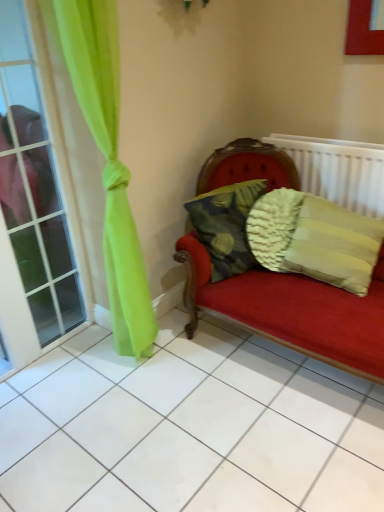
What is the approximate width of camouflage fabric pillow at center, the 1th pillow positioned from the left?

It is 8.81 inches.

The height and width of the screenshot is (512, 384). What do you see at coordinates (32, 211) in the screenshot? I see `clear glass window at left` at bounding box center [32, 211].

This screenshot has width=384, height=512. I want to click on clear glass window at left, so click(x=32, y=211).

The width and height of the screenshot is (384, 512). Identify the location of textured beige pillow at right, arranged as the first pillow when viewed from the right. (314, 239).

The height and width of the screenshot is (512, 384). What are the coordinates of `white textured radiator at upper right` in the screenshot? It's located at (338, 170).

Is textured beige pillow at right, arranged as the second pillow when viewed from the left, oriented away from white textured radiator at upper right?

Yes, white textured radiator at upper right is at the back of textured beige pillow at right, arranged as the second pillow when viewed from the left.

Between textured beige pillow at right, arranged as the first pillow when viewed from the right, and white textured radiator at upper right, which one appears on the right side from the viewer's perspective?

white textured radiator at upper right is more to the right.

Is textured beige pillow at right, arranged as the first pillow when viewed from the right, wider or thinner than white textured radiator at upper right?

Considering their sizes, textured beige pillow at right, arranged as the first pillow when viewed from the right, looks broader than white textured radiator at upper right.

Is clear glass window at left positioned in front of textured beige pillow at right, arranged as the second pillow when viewed from the left?

Yes, clear glass window at left is in front of textured beige pillow at right, arranged as the second pillow when viewed from the left.

From the image's perspective, relative to textured beige pillow at right, arranged as the first pillow when viewed from the right, is clear glass window at left above or below?

Clearly, from the image's perspective, clear glass window at left is above textured beige pillow at right, arranged as the first pillow when viewed from the right.

Is clear glass window at left not near textured beige pillow at right, arranged as the second pillow when viewed from the left?

Yes, clear glass window at left and textured beige pillow at right, arranged as the second pillow when viewed from the left, are quite far apart.

Identify the location of window located in front of the textured beige pillow at right, arranged as the first pillow when viewed from the right. (32, 211).

From a real-world perspective, which is physically above, clear glass window at left or camouflage fabric pillow at center, positioned as the 2th pillow in right-to-left order?

From a 3D spatial view, clear glass window at left is above.

Which point is more forward, (34, 131) or (230, 252)?

The point (230, 252) is in front.

From the image's perspective, relative to camouflage fabric pillow at center, positioned as the 2th pillow in right-to-left order, is clear glass window at left above or below?

clear glass window at left is situated higher than camouflage fabric pillow at center, positioned as the 2th pillow in right-to-left order, in the image.

From their relative heights in the image, would you say clear glass window at left is taller or shorter than camouflage fabric pillow at center, the 1th pillow positioned from the left?

clear glass window at left is taller than camouflage fabric pillow at center, the 1th pillow positioned from the left.

Does textured beige pillow at right, arranged as the first pillow when viewed from the right, appear on the right side of clear glass window at left?

Indeed, textured beige pillow at right, arranged as the first pillow when viewed from the right, is positioned on the right side of clear glass window at left.

Does point (303, 265) come in front of point (9, 63)?

No, it is behind (9, 63).

The image size is (384, 512). I want to click on window to the left of textured beige pillow at right, arranged as the first pillow when viewed from the right, so click(32, 211).

Which of these two, camouflage fabric pillow at center, the 1th pillow positioned from the left, or textured beige pillow at right, arranged as the second pillow when viewed from the left, is smaller?

Smaller between the two is camouflage fabric pillow at center, the 1th pillow positioned from the left.

Does point (241, 272) come farther from viewer compared to point (362, 252)?

Yes, it is.

From the picture: Do you think camouflage fabric pillow at center, positioned as the 2th pillow in right-to-left order, is within textured beige pillow at right, arranged as the second pillow when viewed from the left, or outside of it?

camouflage fabric pillow at center, positioned as the 2th pillow in right-to-left order, is not enclosed by textured beige pillow at right, arranged as the second pillow when viewed from the left.

Does camouflage fabric pillow at center, positioned as the 2th pillow in right-to-left order, come in front of textured beige pillow at right, arranged as the second pillow when viewed from the left?

No, the depth of camouflage fabric pillow at center, positioned as the 2th pillow in right-to-left order, is greater than that of textured beige pillow at right, arranged as the second pillow when viewed from the left.

You are a GUI agent. You are given a task and a screenshot of the screen. Output one action in this format:
    pyautogui.click(x=<x>, y=<y>)
    Task: Click on the 1st pillow below when counting from the white textured radiator at upper right (from the image's perspective)
    The height and width of the screenshot is (512, 384).
    Given the screenshot: What is the action you would take?
    pyautogui.click(x=226, y=226)

Is white textured radiator at upper right thinner than camouflage fabric pillow at center, the 1th pillow positioned from the left?

Correct, the width of white textured radiator at upper right is less than that of camouflage fabric pillow at center, the 1th pillow positioned from the left.

Does point (322, 144) appear closer or farther from the camera than point (236, 189)?

Point (322, 144) appears to be farther away from the viewer than point (236, 189).

Which is behind, point (326, 184) or point (301, 201)?

The point (326, 184) is farther from the camera.

Considering the relative sizes of white textured radiator at upper right and textured beige pillow at right, arranged as the first pillow when viewed from the right, in the image provided, is white textured radiator at upper right wider than textured beige pillow at right, arranged as the first pillow when viewed from the right,?

No, white textured radiator at upper right is not wider than textured beige pillow at right, arranged as the first pillow when viewed from the right.

From the image's perspective, is white textured radiator at upper right over textured beige pillow at right, arranged as the first pillow when viewed from the right?

Yes, from the image's perspective, white textured radiator at upper right is above textured beige pillow at right, arranged as the first pillow when viewed from the right.

Can you confirm if white textured radiator at upper right is taller than textured beige pillow at right, arranged as the second pillow when viewed from the left?

No.

Where is `radiator on the right of textured beige pillow at right, arranged as the first pillow when viewed from the right`? The width and height of the screenshot is (384, 512). radiator on the right of textured beige pillow at right, arranged as the first pillow when viewed from the right is located at coordinates (338, 170).

There is a textured beige pillow at right, arranged as the first pillow when viewed from the right. Where is `window above it (from a real-world perspective)`? The height and width of the screenshot is (512, 384). window above it (from a real-world perspective) is located at coordinates (32, 211).

Based on their spatial positions, is textured beige pillow at right, arranged as the second pillow when viewed from the left, or white textured radiator at upper right closer to clear glass window at left?

textured beige pillow at right, arranged as the second pillow when viewed from the left, is closer to clear glass window at left.

Based on their spatial positions, is white textured radiator at upper right or clear glass window at left closer to camouflage fabric pillow at center, positioned as the 2th pillow in right-to-left order?

white textured radiator at upper right.

From the image, which object appears to be farther from textured beige pillow at right, arranged as the second pillow when viewed from the left, camouflage fabric pillow at center, the 1th pillow positioned from the left, or white textured radiator at upper right?

white textured radiator at upper right.

In the scene shown: Estimate the real-world distances between objects in this image. Which object is closer to white textured radiator at upper right, camouflage fabric pillow at center, positioned as the 2th pillow in right-to-left order, or textured beige pillow at right, arranged as the first pillow when viewed from the right?

textured beige pillow at right, arranged as the first pillow when viewed from the right, is positioned closer to the anchor white textured radiator at upper right.

Based on their spatial positions, is textured beige pillow at right, arranged as the first pillow when viewed from the right, or clear glass window at left closer to white textured radiator at upper right?

The object closer to white textured radiator at upper right is textured beige pillow at right, arranged as the first pillow when viewed from the right.

From the image, which object appears to be farther from textured beige pillow at right, arranged as the second pillow when viewed from the left, white textured radiator at upper right or camouflage fabric pillow at center, positioned as the 2th pillow in right-to-left order?

The object further to textured beige pillow at right, arranged as the second pillow when viewed from the left, is white textured radiator at upper right.

Looking at this image, from the image, which object appears to be nearer to camouflage fabric pillow at center, positioned as the 2th pillow in right-to-left order, white textured radiator at upper right or textured beige pillow at right, arranged as the first pillow when viewed from the right?

textured beige pillow at right, arranged as the first pillow when viewed from the right, lies closer to camouflage fabric pillow at center, positioned as the 2th pillow in right-to-left order, than the other object.

Which object lies further to the anchor point white textured radiator at upper right, camouflage fabric pillow at center, positioned as the 2th pillow in right-to-left order, or clear glass window at left?

Among the two, clear glass window at left is located further to white textured radiator at upper right.

Locate an element on the screen. This screenshot has height=512, width=384. pillow situated between camouflage fabric pillow at center, positioned as the 2th pillow in right-to-left order, and white textured radiator at upper right from left to right is located at coordinates (314, 239).

In order to click on pillow between clear glass window at left and textured beige pillow at right, arranged as the first pillow when viewed from the right, from left to right in this screenshot , I will do `click(226, 226)`.